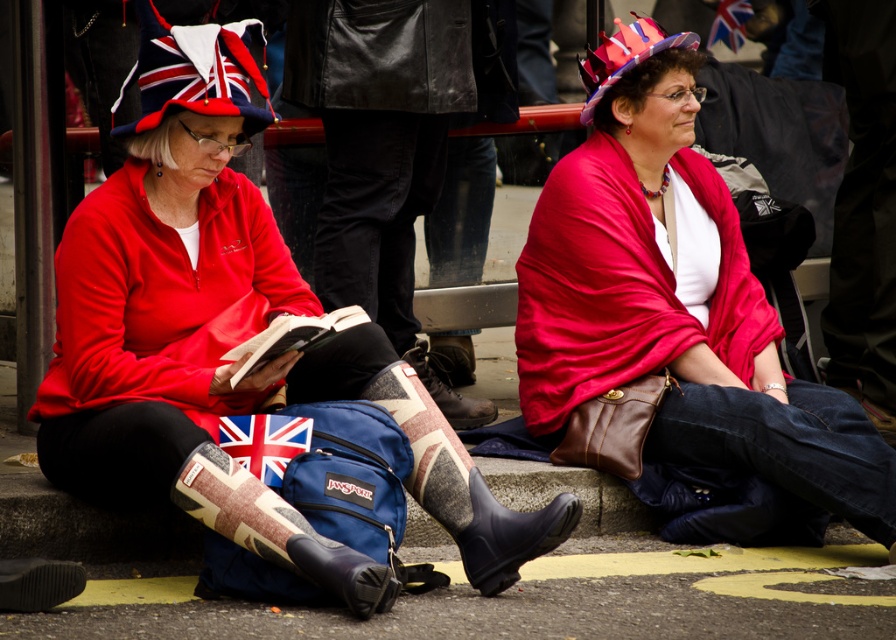
You are standing at the point marked as point (x=264, y=442). What is the closest object to you?

The closest object to point (x=264, y=442) is the union jack fabric at center.

You are a photographer trying to capture both the union jack fabric at center and the union jack flag at upper center in a single frame. Which one should you focus on to ensure both are visible without cropping?

The union jack fabric at center is bigger than the union jack flag at upper center, so focusing on the larger union jack fabric at center will allow both to fit within the frame without cropping.